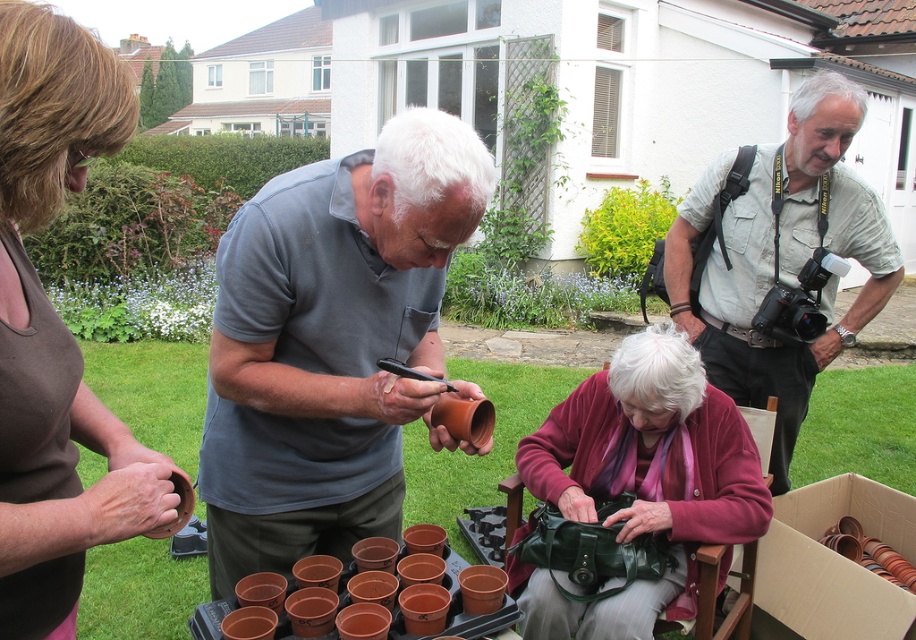
Who is taller, khaki cotton shirt at upper right or brown cardboard box at lower right?

khaki cotton shirt at upper right is taller.

Is khaki cotton shirt at upper right below brown cardboard box at lower right?

No, khaki cotton shirt at upper right is not below brown cardboard box at lower right.

Who is more forward, (689, 339) or (870, 493)?

Point (689, 339) is more forward.

Where is `khaki cotton shirt at upper right`? The width and height of the screenshot is (916, 640). khaki cotton shirt at upper right is located at coordinates (782, 256).

Can you confirm if velvet purple scarf at center is positioned below khaki cotton shirt at upper right?

Correct, velvet purple scarf at center is located below khaki cotton shirt at upper right.

Is velvet purple scarf at center thinner than khaki cotton shirt at upper right?

Yes.

Is point (656, 488) positioned in front of point (766, 273)?

Yes, it is.

The height and width of the screenshot is (640, 916). I want to click on velvet purple scarf at center, so click(x=641, y=481).

Is velvet purple scarf at center closer to the viewer compared to brown plastic tray at lower center?

No, velvet purple scarf at center is behind brown plastic tray at lower center.

Is point (540, 456) positioned in front of point (462, 632)?

No, it is not.

Which is in front, point (630, 598) or point (202, 636)?

Point (202, 636) is in front.

You are a GUI agent. You are given a task and a screenshot of the screen. Output one action in this format:
    pyautogui.click(x=<x>, y=<y>)
    Task: Click on the velvet purple scarf at center
    This screenshot has width=916, height=640.
    Given the screenshot: What is the action you would take?
    pyautogui.click(x=641, y=481)